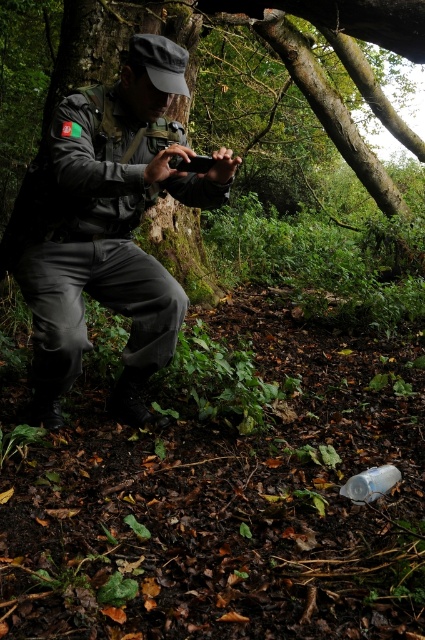
Can you confirm if matte black uniform at center is bigger than green mossy tree trunk at center?

Correct, matte black uniform at center is larger in size than green mossy tree trunk at center.

Between matte black uniform at center and green mossy tree trunk at center, which one is positioned lower?

matte black uniform at center

Locate an element on the screen. The width and height of the screenshot is (425, 640). matte black uniform at center is located at coordinates (107, 225).

Image resolution: width=425 pixels, height=640 pixels. Find the location of `matte black uniform at center`. matte black uniform at center is located at coordinates (107, 225).

Between green mossy tree trunk at center and transparent plastic bottle at lower center, which one appears on the left side from the viewer's perspective?

Positioned to the left is green mossy tree trunk at center.

Which is in front, point (65, 61) or point (382, 492)?

Point (382, 492) is in front.

Where is `green mossy tree trunk at center`? This screenshot has height=640, width=425. green mossy tree trunk at center is located at coordinates (325, 76).

Is matte black uniform at center positioned before transparent plastic bottle at lower center?

Yes, it is.

Who is higher up, matte black uniform at center or transparent plastic bottle at lower center?

Positioned higher is matte black uniform at center.

Is point (136, 144) positioned behind point (363, 499)?

Yes, it is.

Locate an element on the screen. matte black uniform at center is located at coordinates (107, 225).